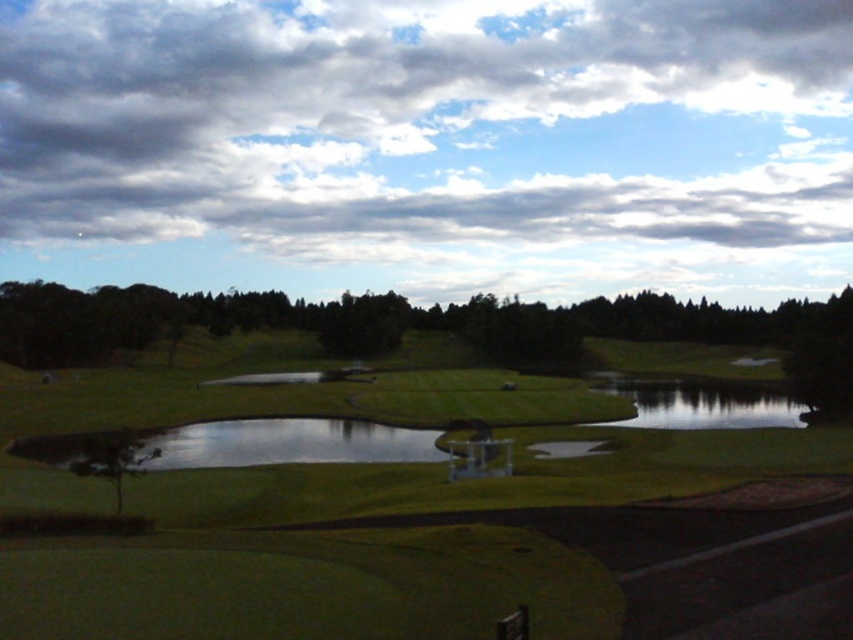
Question: Is green grassy golf course at center closer to camera compared to green leafy tree at lower left?

Choices:
 (A) yes
 (B) no

Answer: (A)

Question: Is green grassy golf course at center to the right of green leafy tree at lower left from the viewer's perspective?

Choices:
 (A) yes
 (B) no

Answer: (A)

Question: Considering the real-world distances, which object is closest to the green leafy tree at lower left?

Choices:
 (A) green reflective water at center
 (B) green grassy golf course at center

Answer: (B)

Question: Which of the following is the closest to the observer?

Choices:
 (A) green reflective water at center
 (B) green leafy tree at lower left
 (C) green grassy golf course at center

Answer: (C)

Question: Estimate the real-world distances between objects in this image. Which object is closer to the green grassy golf course at center?

Choices:
 (A) green leafy tree at lower left
 (B) green reflective water at center

Answer: (A)

Question: Is green grassy golf course at center further to the viewer compared to green leafy tree at lower left?

Choices:
 (A) yes
 (B) no

Answer: (B)